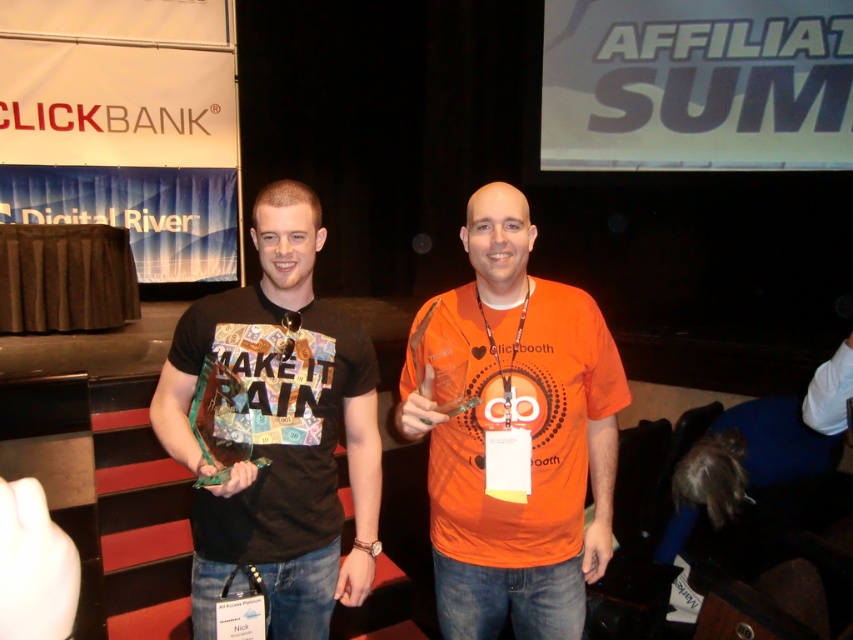
Can you confirm if orange matte shirt at center is positioned below matte black t-shirt at center?

Correct, orange matte shirt at center is located below matte black t-shirt at center.

Does orange matte shirt at center have a smaller size compared to matte black t-shirt at center?

No.

Identify the location of orange matte shirt at center. (515, 435).